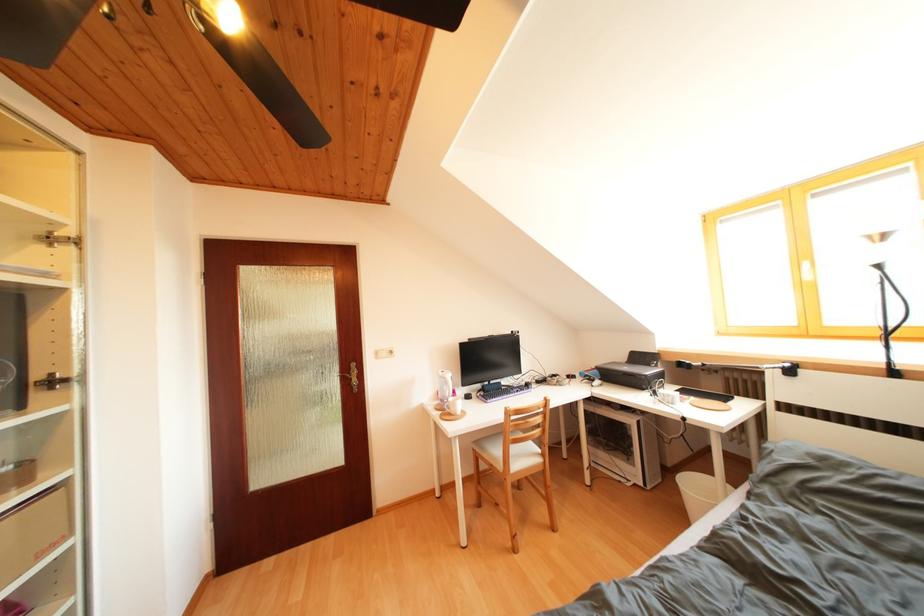
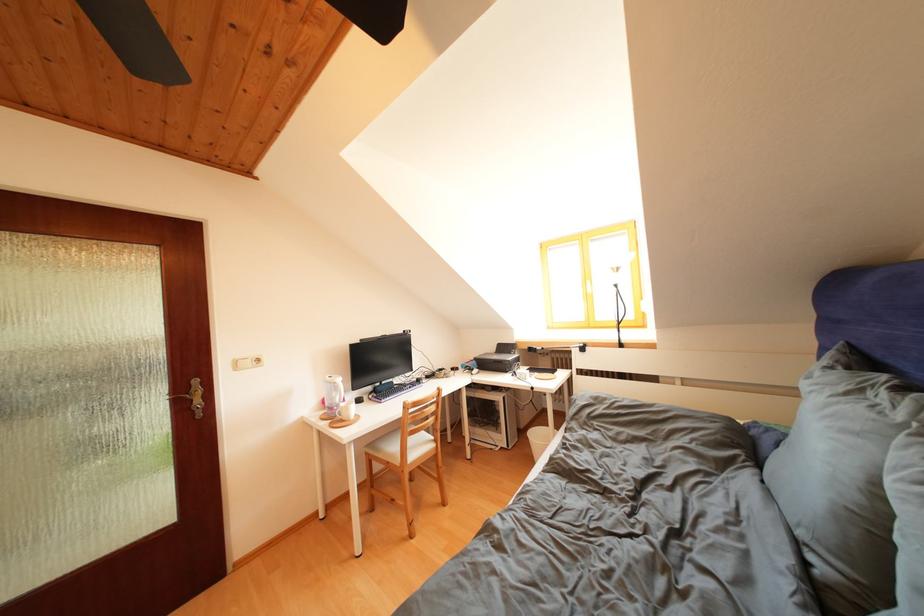
The point at (x=454, y=392) is marked in the first image. Where is the corresponding point in the second image?

(342, 399)